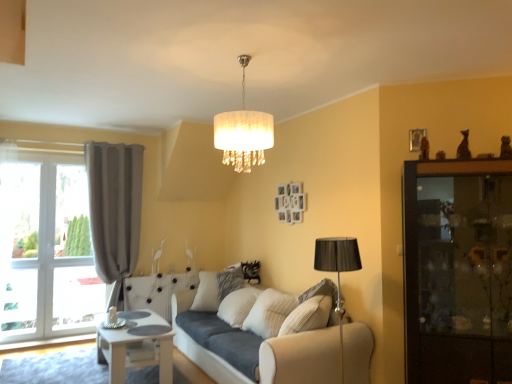
Question: Relative to white fabric lampshade at center, is beige fabric couch at center in front or behind?

Choices:
 (A) behind
 (B) front

Answer: (A)

Question: From a real-world perspective, is beige fabric couch at center physically located above or below white fabric lampshade at center?

Choices:
 (A) above
 (B) below

Answer: (B)

Question: Which object is the closest to the white fabric lampshade at center?

Choices:
 (A) matte gray curtain at left
 (B) dark wood cabinet at right
 (C) beige fabric couch at center
 (D) white painted wood table at lower left

Answer: (C)

Question: Estimate the real-world distances between objects in this image. Which object is farther from the white fabric lampshade at center?

Choices:
 (A) dark wood cabinet at right
 (B) matte gray curtain at left
 (C) white painted wood table at lower left
 (D) beige fabric couch at center

Answer: (B)